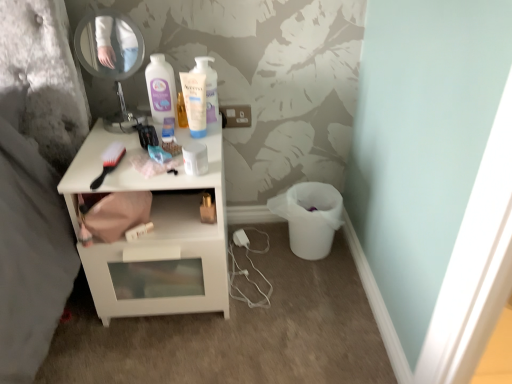
Question: Looking at their shapes, would you say metallic round mirror at upper left is wider or thinner than white glossy nightstand at center?

Choices:
 (A) thin
 (B) wide

Answer: (A)

Question: Is metallic round mirror at upper left bigger or smaller than white glossy nightstand at center?

Choices:
 (A) big
 (B) small

Answer: (B)

Question: Which object is the closest to the white glossy nightstand at center?

Choices:
 (A) black plastic brush at upper left
 (B) metallic round mirror at upper left

Answer: (A)

Question: Which is farther from the metallic round mirror at upper left?

Choices:
 (A) black plastic brush at upper left
 (B) white glossy nightstand at center

Answer: (B)